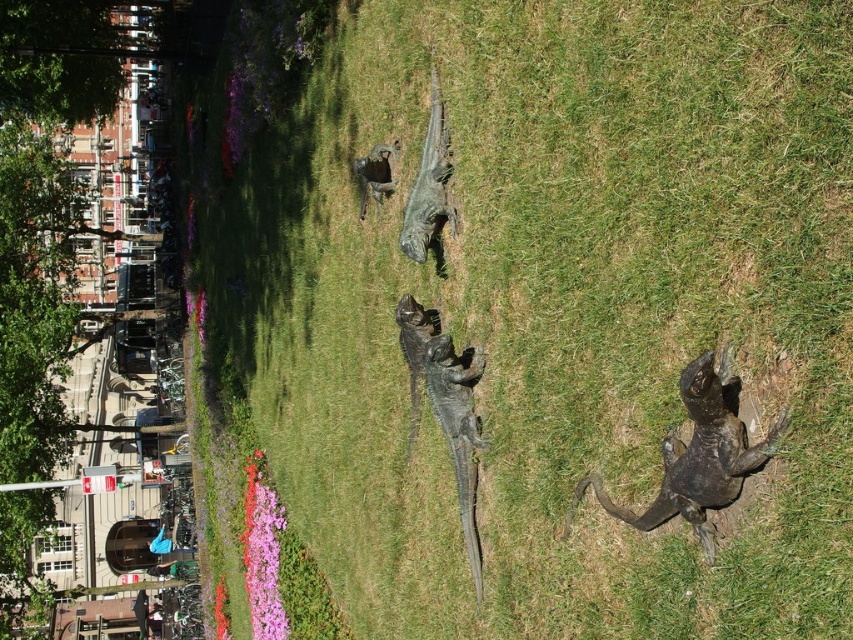
You are a park visitor who wants to take a photo of both the shiny black lizard at center and the green polished stone dinosaur at center. Since you can only focus on one object at a time, which one should you aim the camera at first to ensure the other is in the background?

You should aim the camera at the shiny black lizard at center first because it is positioned below the green polished stone dinosaur at center, so the dinosaur will naturally appear in the background when focusing on the lower object.

You are standing in the park and want to take a photo of both point (573, 506) and point (366, 189). Which point should you focus on first to ensure both are in focus?

You should focus on point (366, 189) first because it is farther from the camera than point (573, 506). By focusing on the farther point, the closer point will also be within the depth of field.